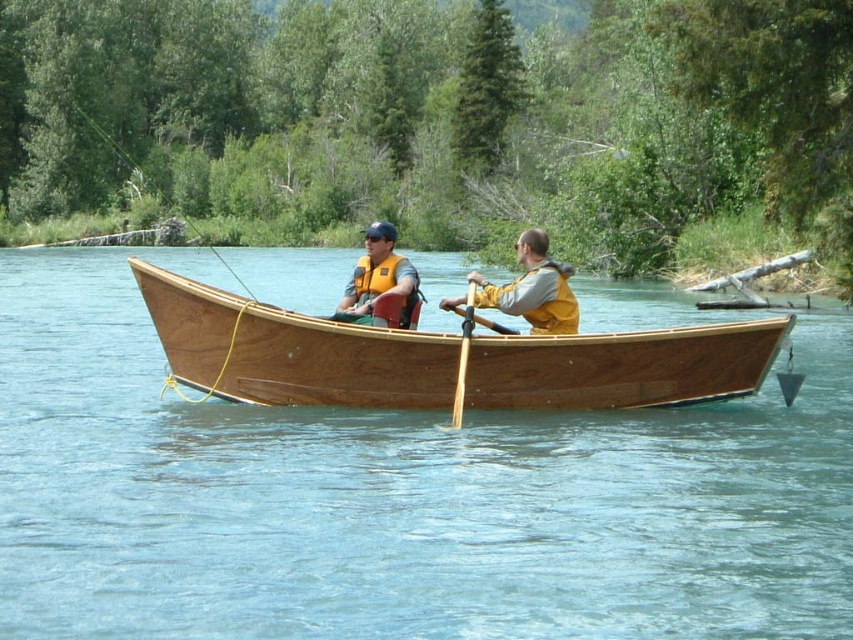
Question: Which point appears closest to the camera in this image?

Choices:
 (A) (515, 310)
 (B) (473, 304)
 (C) (358, 280)
 (D) (202, 298)

Answer: (D)

Question: Estimate the real-world distances between objects in this image. Which object is farther from the wooden paddle at center?

Choices:
 (A) matte yellow life jacket at center
 (B) yellow life vest at center
 (C) wooden boat at center
 (D) matte yellow life vest at center

Answer: (D)

Question: Estimate the real-world distances between objects in this image. Which object is farther from the yellow life vest at center?

Choices:
 (A) wooden paddle at center
 (B) matte yellow life jacket at center
 (C) wooden boat at center

Answer: (C)

Question: Is matte yellow life jacket at center to the left of wooden paddle at center from the viewer's perspective?

Choices:
 (A) no
 (B) yes

Answer: (B)

Question: Is yellow life vest at center to the right of matte yellow life jacket at center from the viewer's perspective?

Choices:
 (A) yes
 (B) no

Answer: (A)

Question: Is yellow life vest at center thinner than matte yellow life jacket at center?

Choices:
 (A) yes
 (B) no

Answer: (B)